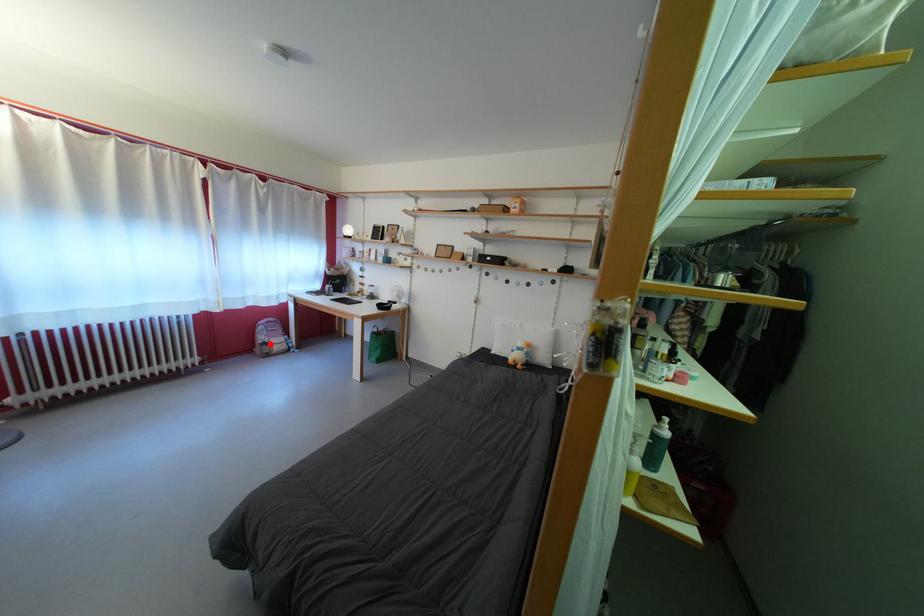
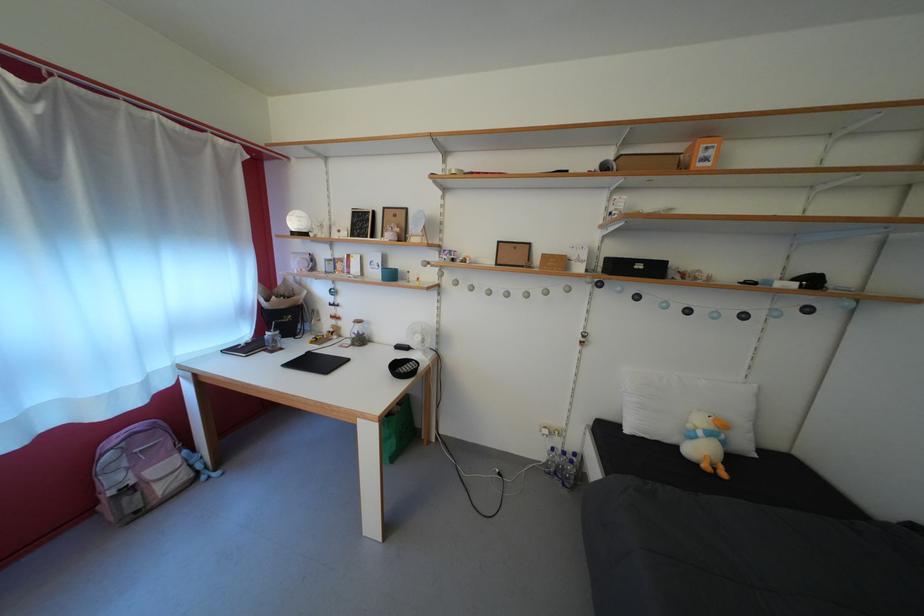
In the second image, find the point that corresponds to the highlighted location in the first image.

(123, 485)